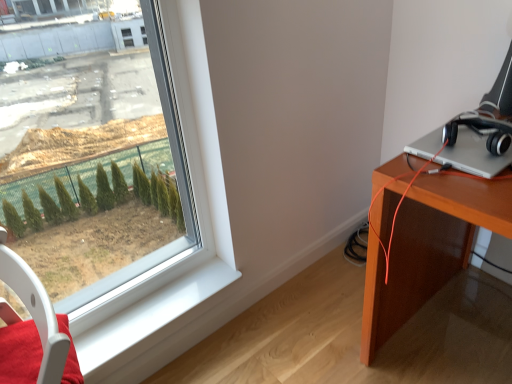
You are a GUI agent. You are given a task and a screenshot of the screen. Output one action in this format:
    pyautogui.click(x=<x>, y=<y>)
    Task: Click on the free location above silver metallic laptop at upper right (from a real-world perspective)
    Image resolution: width=512 pixels, height=384 pixels.
    Given the screenshot: What is the action you would take?
    pyautogui.click(x=467, y=137)